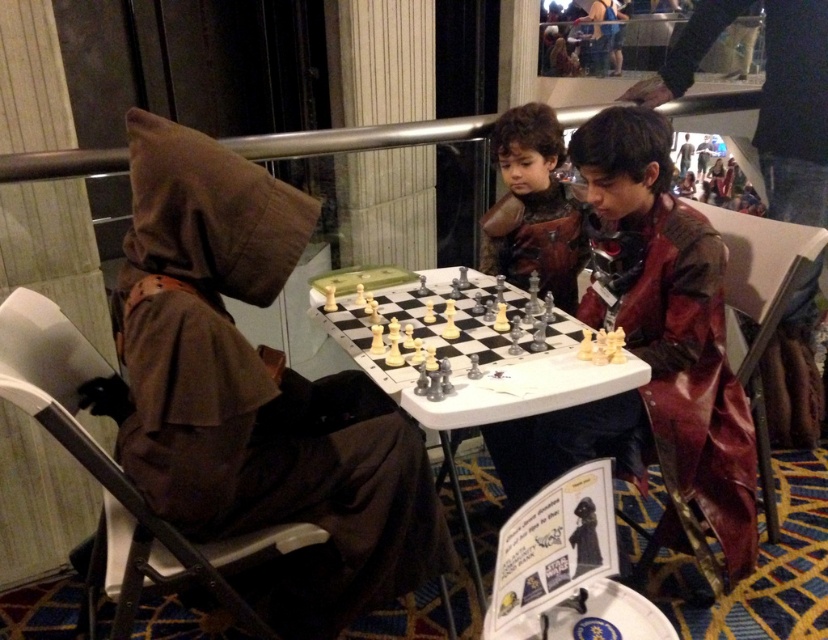
Is brown leather armor at center behind metallic chess set at center?

Yes, it is behind metallic chess set at center.

Is brown leather armor at center below metallic chess set at center?

No, brown leather armor at center is not below metallic chess set at center.

Consider the image. Who is more forward, (x=523, y=180) or (x=340, y=316)?

Point (x=340, y=316) is in front.

Image resolution: width=828 pixels, height=640 pixels. In order to click on brown leather armor at center in this screenshot , I will do `click(533, 209)`.

Between brown fabric hood at upper left and brown leather armor at center, which one has less height?

With less height is brown leather armor at center.

Which is below, brown fabric hood at upper left or brown leather armor at center?

brown fabric hood at upper left

You are a GUI agent. You are given a task and a screenshot of the screen. Output one action in this format:
    pyautogui.click(x=<x>, y=<y>)
    Task: Click on the brown fabric hood at upper left
    Image resolution: width=828 pixels, height=640 pixels.
    Given the screenshot: What is the action you would take?
    pyautogui.click(x=256, y=394)

Which of these two, brown fabric hood at upper left or metallic chess set at center, stands taller?

With more height is brown fabric hood at upper left.

What do you see at coordinates (256, 394) in the screenshot? I see `brown fabric hood at upper left` at bounding box center [256, 394].

Locate an element on the screen. brown fabric hood at upper left is located at coordinates (256, 394).